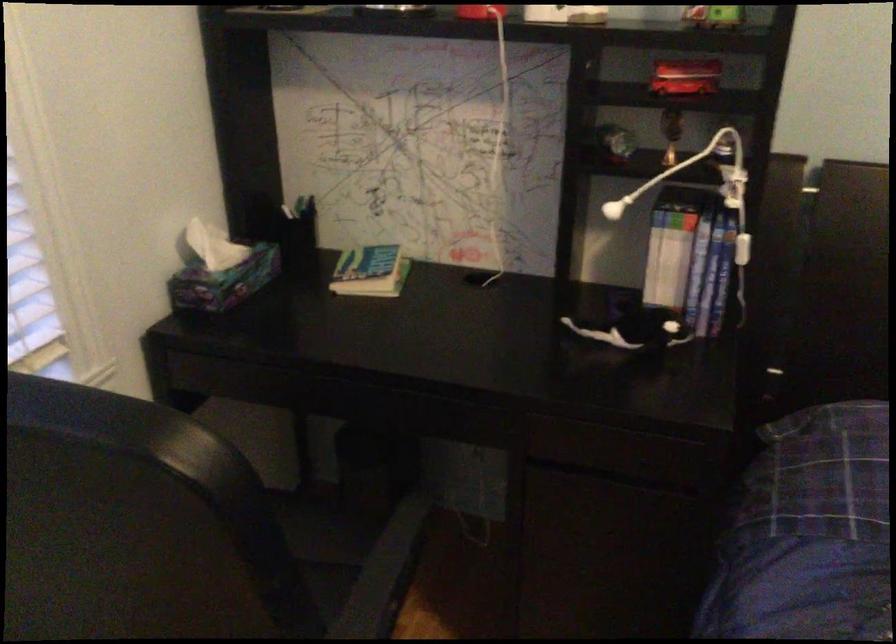
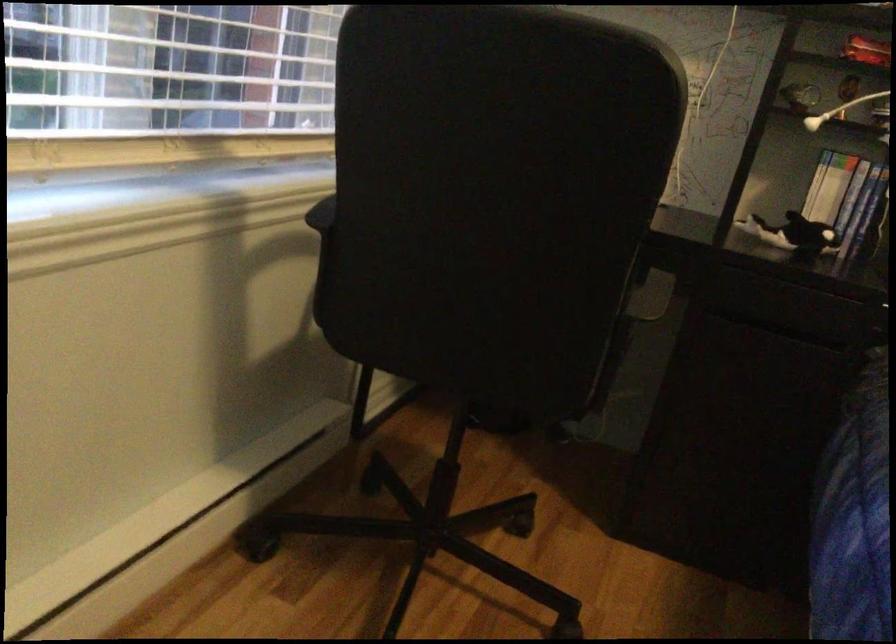
Question: I am providing you with two images of the same scene from different viewpoints. After the viewpoint changes to image2, which objects are now occluded?

Choices:
 (A) black chair armrest
 (B) white bench lid
 (C) white earbud
 (D) small paper book

Answer: (D)